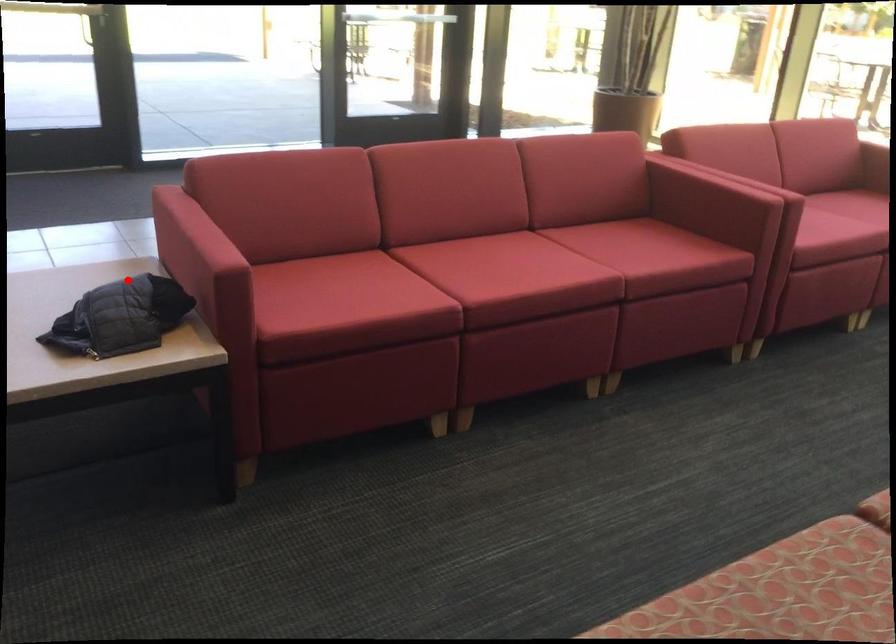
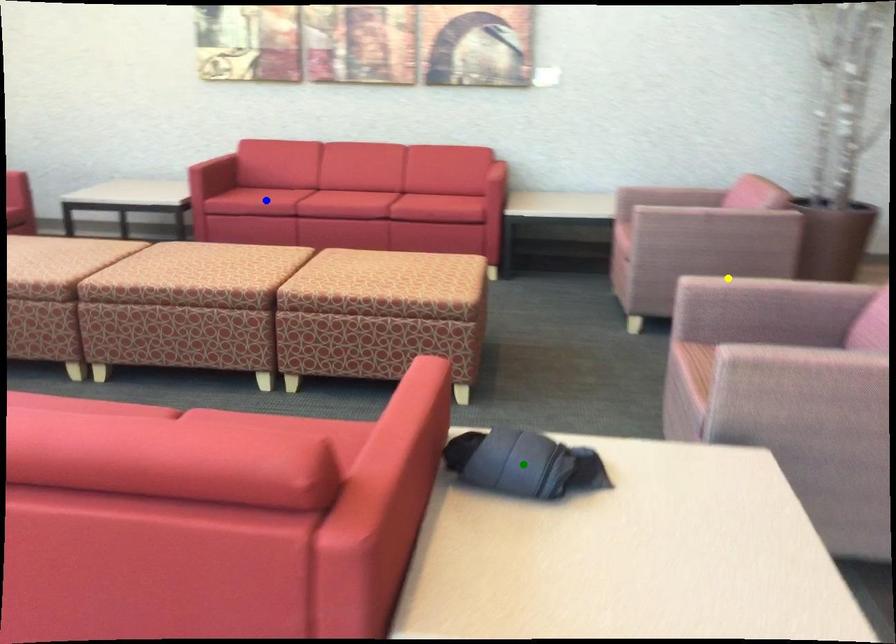
Question: I am providing you with two images of the same scene from different viewpoints. A red point is marked on the first image. You are given multiple points on the second image. Can you choose the point in image 2 that corresponds to the point in image 1?

Choices:
 (A) yellow point
 (B) green point
 (C) blue point

Answer: (B)